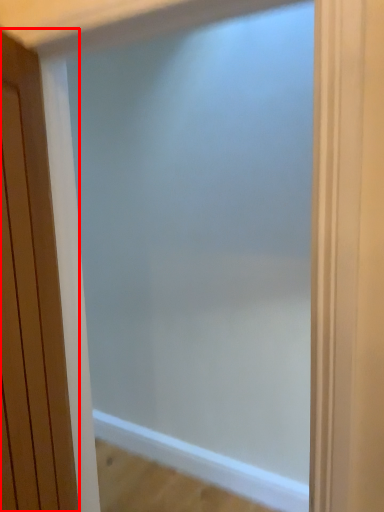
Question: From the image's perspective, what is the correct spatial relationship of door (annotated by the red box) in relation to screen door?

Choices:
 (A) below
 (B) above

Answer: (B)